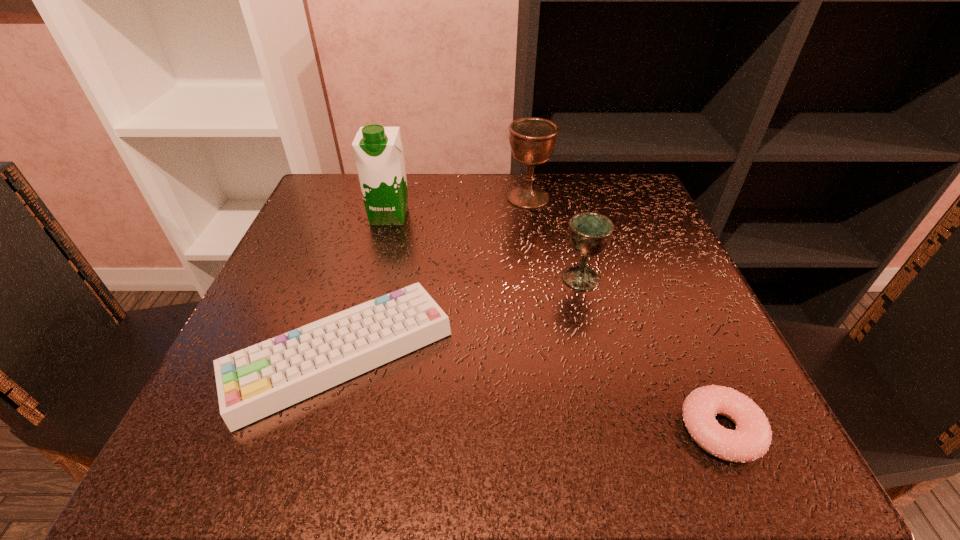
Where is `vacant space situated 0.380m on the left of the third shortest object`? The image size is (960, 540). vacant space situated 0.380m on the left of the third shortest object is located at coordinates (355, 278).

The width and height of the screenshot is (960, 540). I want to click on vacant space situated on the back of the computer keyboard, so coord(370,249).

The width and height of the screenshot is (960, 540). In order to click on vacant space located 0.370m on the back of the rightmost object in this screenshot , I will do `click(636, 239)`.

This screenshot has height=540, width=960. I want to click on soya milk that is at the far edge, so click(378, 150).

Find the location of `chalice present at the far edge`. chalice present at the far edge is located at coordinates (532, 140).

The height and width of the screenshot is (540, 960). In order to click on computer keyboard at the near edge in this screenshot , I will do `click(255, 382)`.

At what (x,y) coordinates should I click in order to perform the action: click on doughnut that is at the near edge. Please return your answer as a coordinate pair (x, y). The height and width of the screenshot is (540, 960). Looking at the image, I should click on (750, 441).

Where is `soya milk positioned at the left edge`? soya milk positioned at the left edge is located at coordinates (378, 150).

Locate an element on the screen. computer keyboard situated at the left edge is located at coordinates (255, 382).

In order to click on chalice that is at the right edge in this screenshot , I will do `click(589, 233)`.